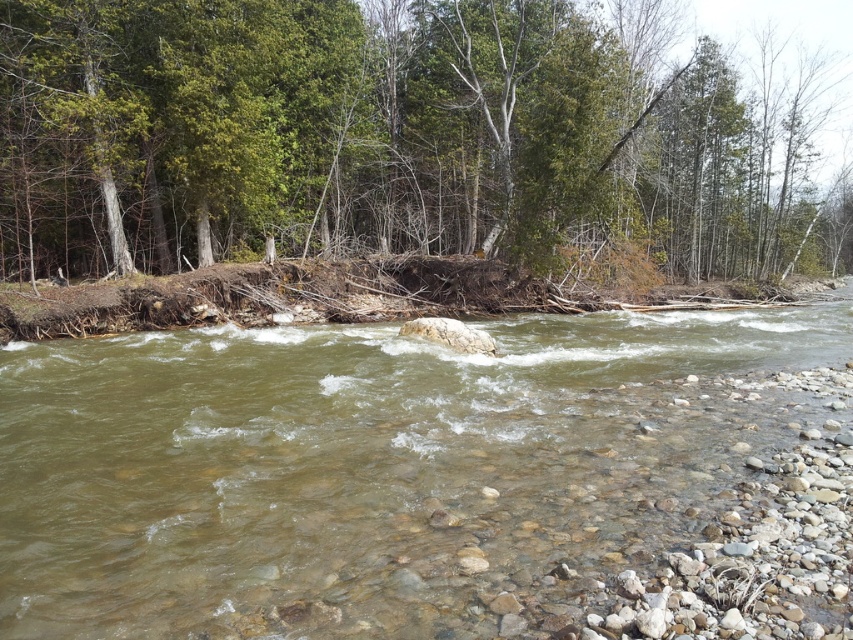
Question: Considering the real-world distances, which object is closest to the green leafy tree at upper center?

Choices:
 (A) white smooth rock at center
 (B) clear sedimentary rock at center

Answer: (B)

Question: Can you confirm if green leafy tree at upper center is thinner than white smooth rock at center?

Choices:
 (A) no
 (B) yes

Answer: (A)

Question: Does clear sedimentary rock at center have a larger size compared to white smooth rock at center?

Choices:
 (A) yes
 (B) no

Answer: (A)

Question: Which point appears closest to the camera in this image?

Choices:
 (A) (77, 83)
 (B) (463, 337)

Answer: (B)

Question: Which object is positioned farthest from the clear sedimentary rock at center?

Choices:
 (A) green leafy tree at upper center
 (B) white smooth rock at center

Answer: (A)

Question: Does green leafy tree at upper center lie in front of white smooth rock at center?

Choices:
 (A) yes
 (B) no

Answer: (B)